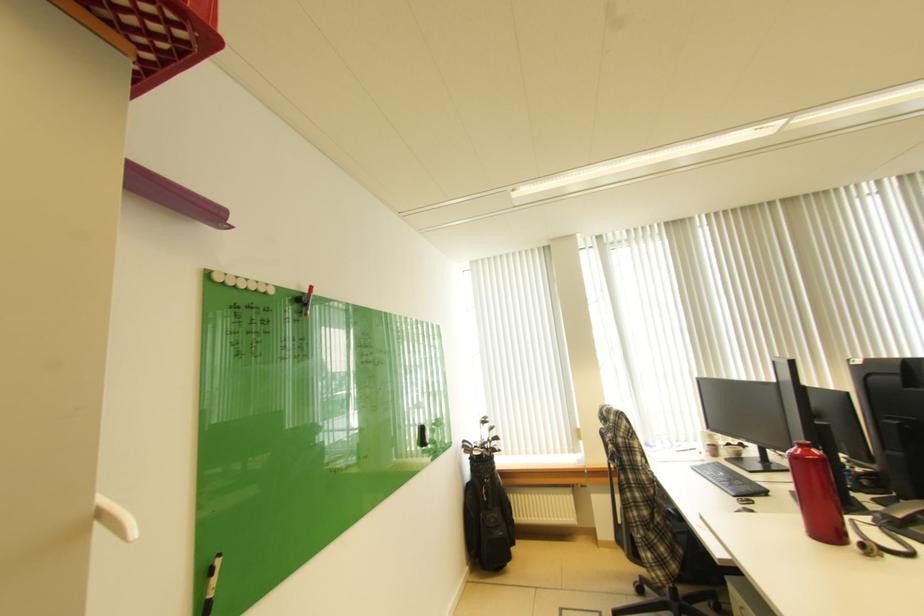
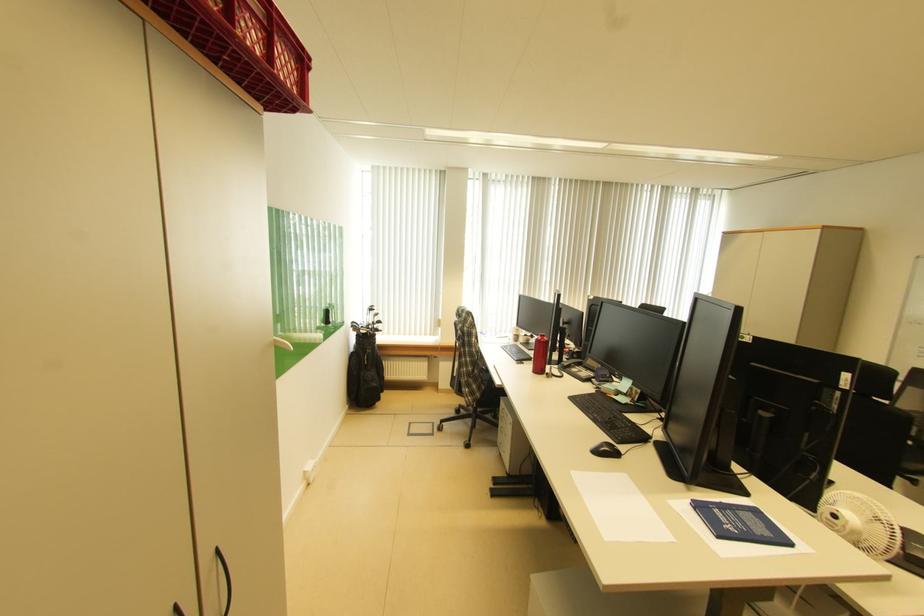
First-person continuous shooting, in which direction is the camera rotating?

The camera rotated toward right-down.